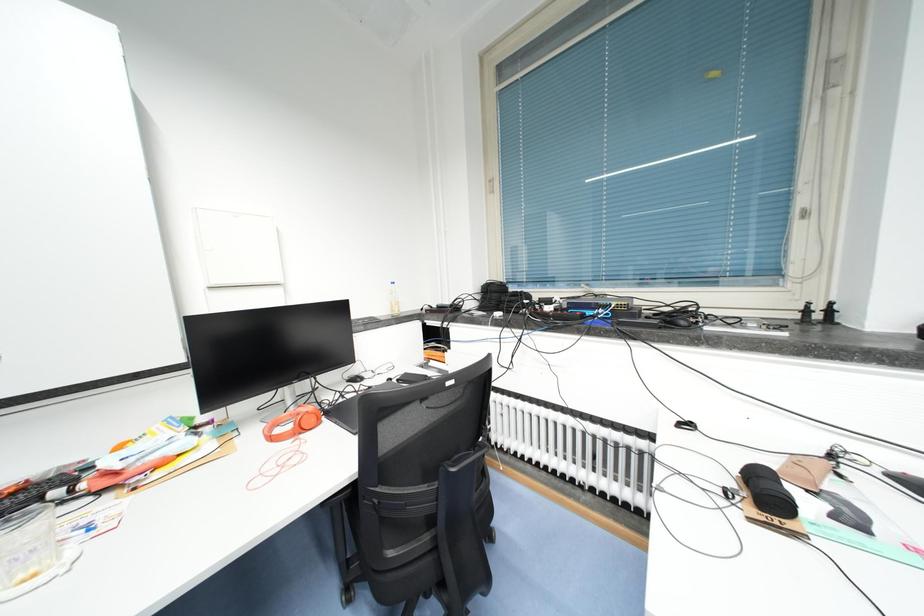
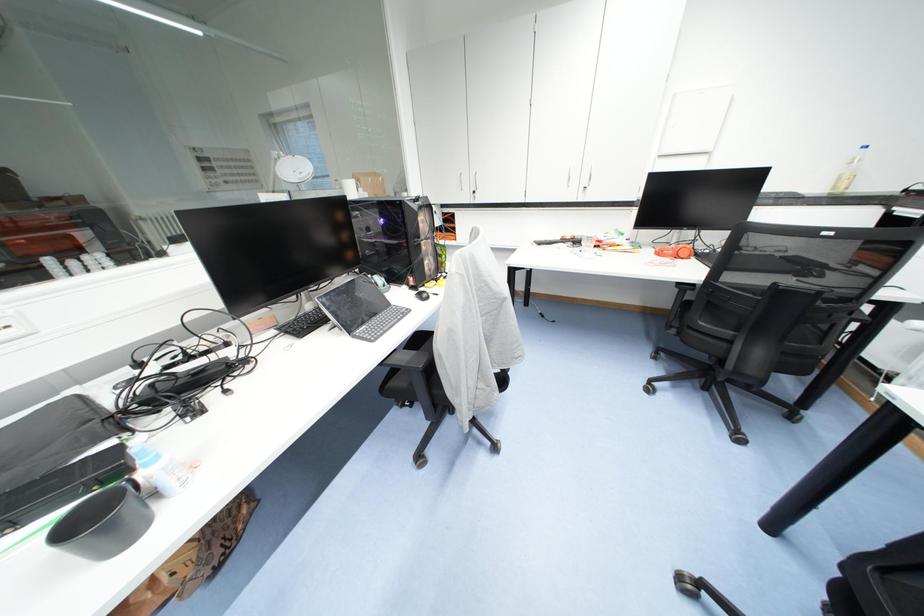
Based on the continuous images, in which direction is the camera rotating?

The rotation direction of the camera is left-down.